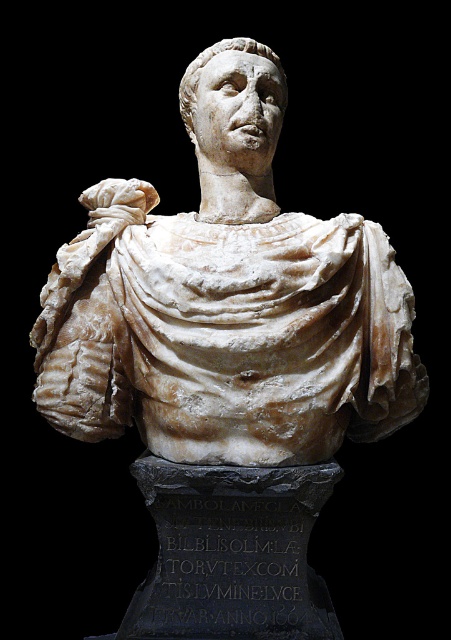
You are an art student analyzing the classical marble sculpture. You notice two parts labeled as the white marble bust at center and the white marble head at center. Which part is taller?

The white marble bust at center is much taller than the white marble head at center.

You are an art student analyzing the classical marble bust in the image. You notice a specific point labeled as point 1 at coordinates (226, 301). Based on the description, where is this point located in relation to the bust?

The point (226, 301) is located at the center of the white marble bust, indicating its central position in the image.

You are an art student examining a classical sculpture. You notice two parts of the sculpture labeled as the white marble bust at center and the white marble head at center. Which one is positioned to the right side of the other?

The white marble bust at center is positioned to the right of the white marble head at center.